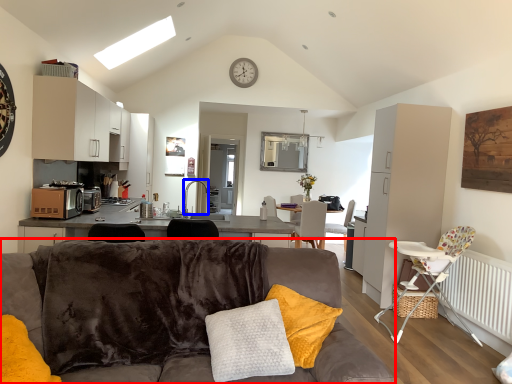
Question: Which object is further to the camera taking this photo, studio couch (highlighted by a red box) or faucet (highlighted by a blue box)?

Choices:
 (A) studio couch
 (B) faucet

Answer: (B)